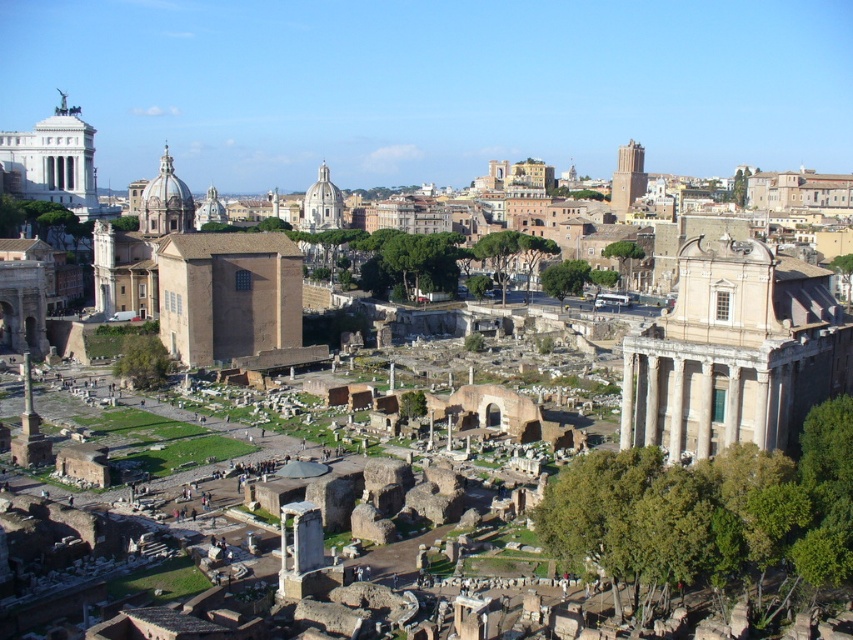
Question: Among these objects, which one is farthest from the camera?

Choices:
 (A) brown brick wall at center
 (B) white marble ruins at center right

Answer: (A)

Question: Is white marble ruins at center right above brown brick wall at center?

Choices:
 (A) no
 (B) yes

Answer: (A)

Question: Is white marble ruins at center right positioned before brown brick wall at center?

Choices:
 (A) no
 (B) yes

Answer: (B)

Question: Is white marble ruins at center right above brown brick wall at center?

Choices:
 (A) no
 (B) yes

Answer: (A)

Question: Which point is closer to the camera?

Choices:
 (A) brown brick wall at center
 (B) white marble ruins at center right

Answer: (B)